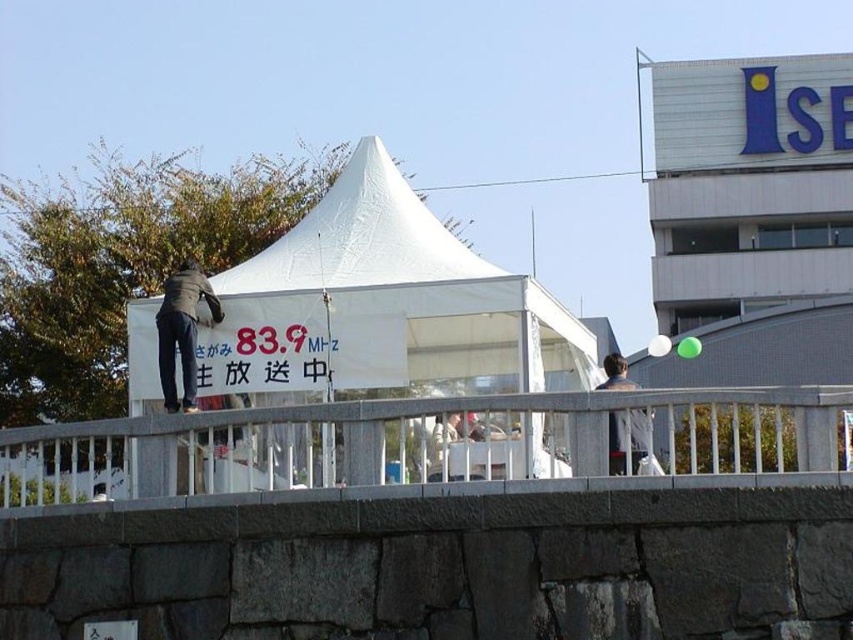
Does point (183, 280) come closer to viewer compared to point (625, 429)?

No, (183, 280) is further to viewer.

Is point (167, 388) more distant than point (613, 465)?

Yes, it is behind point (613, 465).

Locate an element on the screen. dark gray jacket at left is located at coordinates (181, 332).

Who is taller, white plastic railing at center or white fabric tent at center?

white fabric tent at center is taller.

Locate an element on the screen. Image resolution: width=853 pixels, height=640 pixels. white plastic railing at center is located at coordinates (425, 449).

Is white fabric tent at center positioned behind dark gray jacket at left?

No, white fabric tent at center is in front of dark gray jacket at left.

Is point (369, 268) farther from viewer compared to point (199, 284)?

That is True.

Between point (146, 314) and point (173, 387), which one is positioned behind?

Positioned behind is point (146, 314).

Find the location of a particular element. The image size is (853, 640). white fabric tent at center is located at coordinates (386, 305).